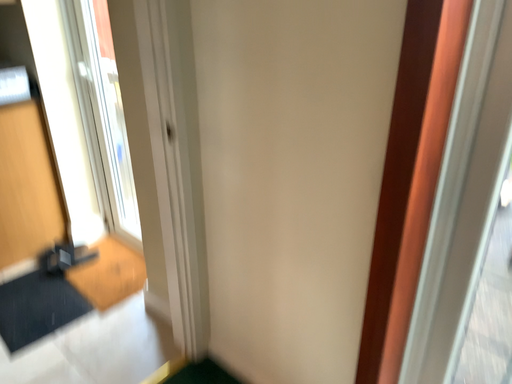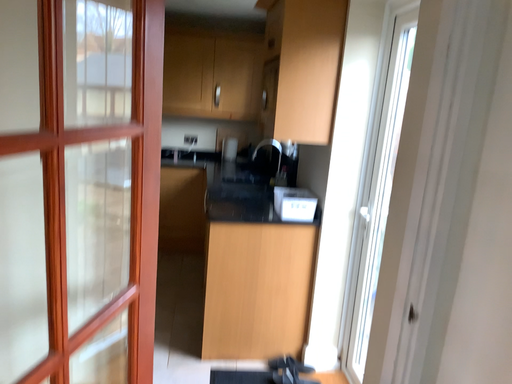
Question: Which way did the camera rotate in the video?

Choices:
 (A) rotated downward
 (B) rotated upward

Answer: (B)